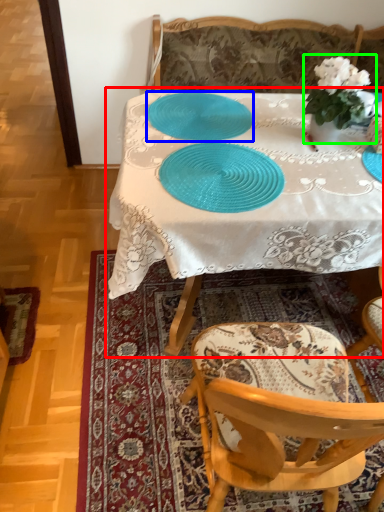
Question: Considering the real-world distances, which object is farthest from table (highlighted by a red box)? tableware (highlighted by a blue box) or houseplant (highlighted by a green box)?

Choices:
 (A) tableware
 (B) houseplant

Answer: (B)